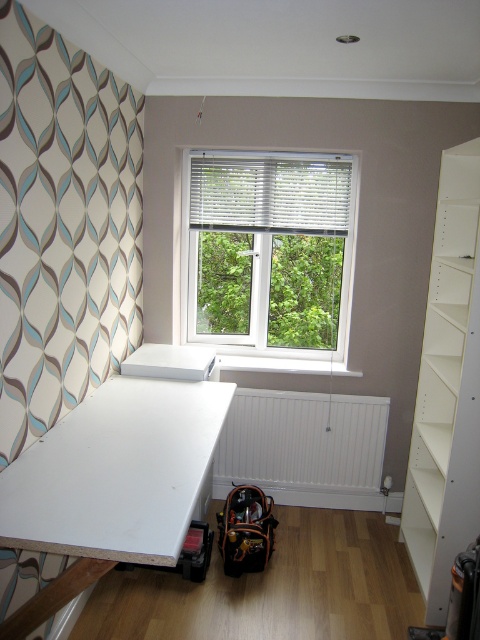
You are organizing the room and need to place a new plant pot between the white matte bookshelf at right and the white matte radiator at lower center. Which side of the radiator should you place the pot to ensure it aligns with the existing arrangement?

You should place the plant pot to the right side of the white matte radiator at lower center because the white matte bookshelf at right is already positioned to its right, maintaining the alignment.

You are organizing the room and need to move the white matte bookshelf at right to make space for a new sofa. Since the white matte radiator at lower center is in the way, can you slide the bookshelf backward to move it out of the way?

The white matte bookshelf at right is in front of the white matte radiator at lower center, so it cannot be slid backward without hitting the radiator. You will need to move it sideways or forward instead.

You are organizing the room and need to place a large potted plant. The plant requires a spot near the white plastic window at center for sunlight but also needs to be placed on the white matte bookshelf at right for stability. Is there a way to position the plant to meet both requirements?

The white plastic window at center is positioned over the white matte bookshelf at right, so placing the plant on the bookshelf would naturally place it under the window, meeting both sunlight and stability needs.